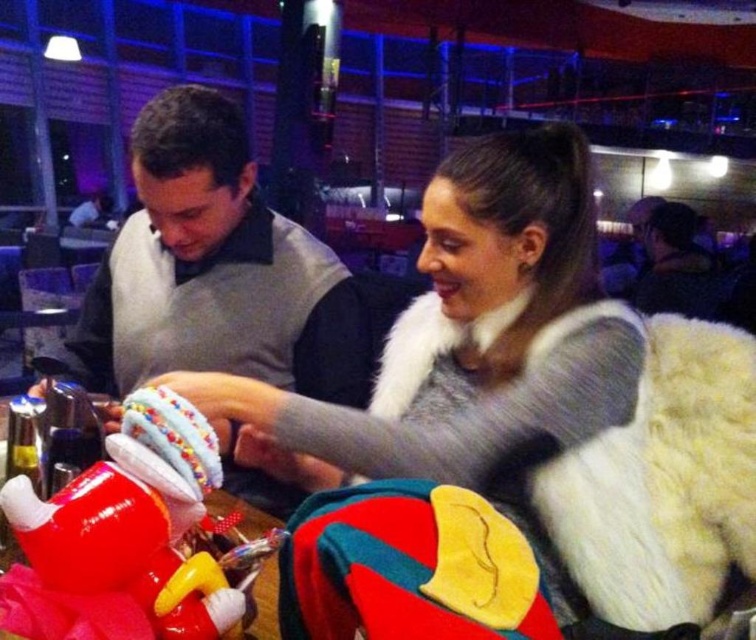
You are a guest at this event and want to approach the person wearing the fuzzy gray vest at upper right. Which direction should you move from the gray sweater vest at center?

You should move to the right from the gray sweater vest at center to reach the fuzzy gray vest at upper right since the gray sweater vest at center is to the left of the fuzzy gray vest at upper right.

You are a photographer setting up a shoot in this scene. You need to position a light source so it illuminates both the white fur coat at center and the rubberized plastic toy at lower left without casting harsh shadows. Considering their sizes, which object should be placed closer to the light source?

The rubberized plastic toy at lower left should be placed closer to the light source because the white fur coat at center is taller than the rubberized plastic toy at lower left, so positioning the smaller toy nearer ensures even lighting and reduces harsh shadows.

You are a delivery drone operator trying to deliver a package to the rubberized plastic toy at lower left. The drone has a maximum delivery range of 22 inches. Can the drone successfully deliver the package?

The distance between the rubberized plastic toy at lower left and the camera is 21.98 inches, which is within the drone operator maximum delivery range of 22 inches. The drone can successfully deliver the package to the rubberized plastic toy at lower left.